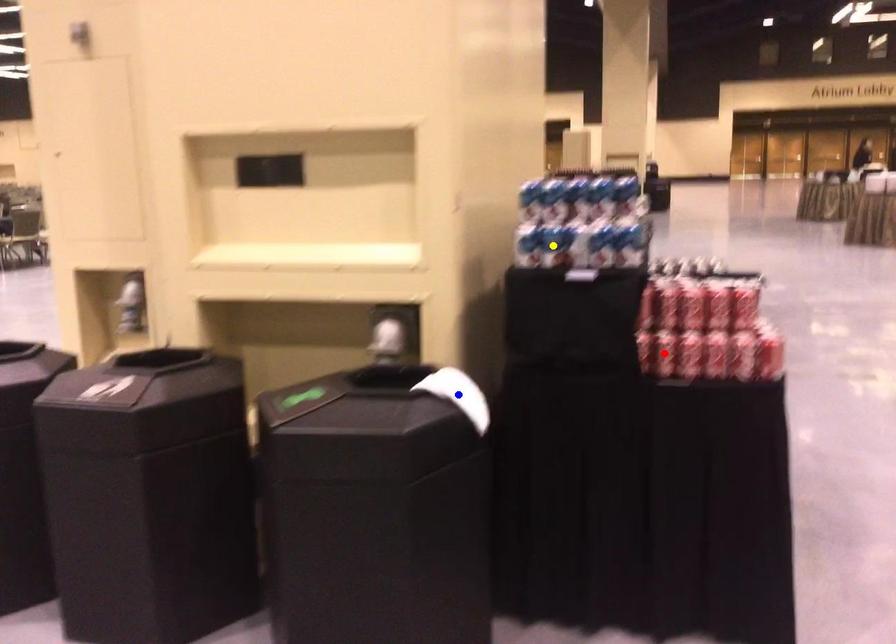
Order these from nearest to farthest:
yellow point
red point
blue point

1. yellow point
2. red point
3. blue point